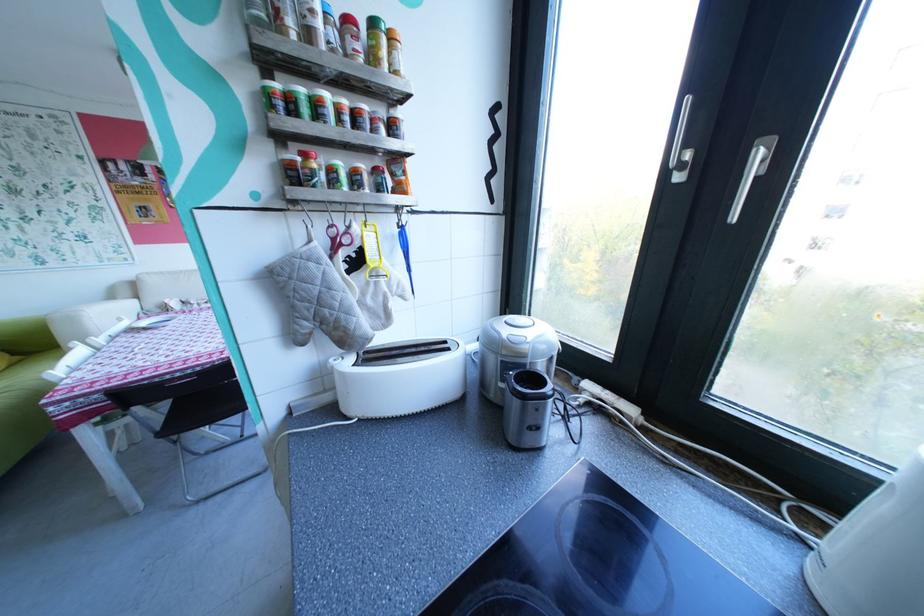
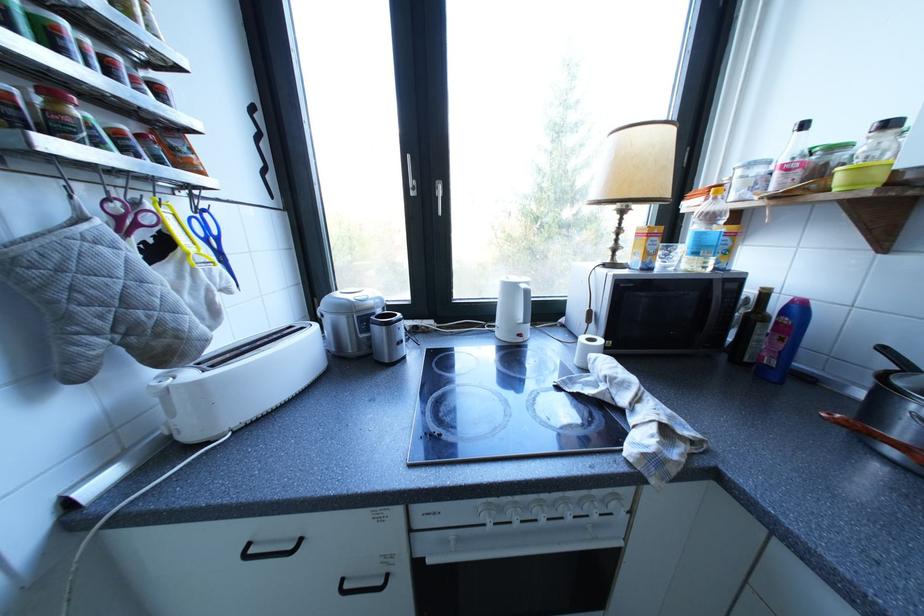
Find the pixel in the second image that matches the point at 306,307 in the first image.

(79, 318)